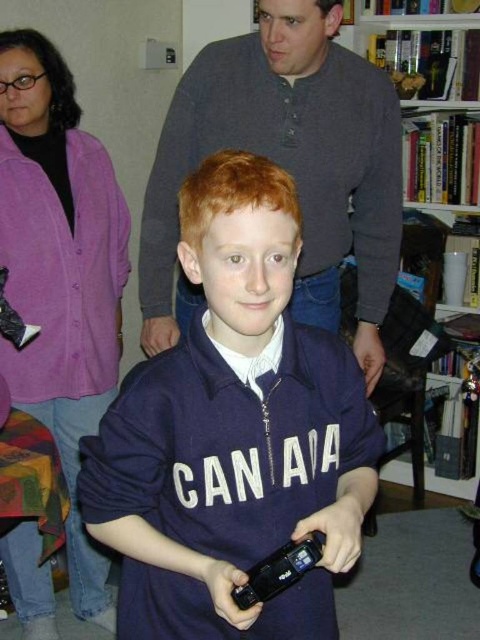
Does dark gray sweater at upper center have a smaller size compared to hardcover books at upper right?

No, dark gray sweater at upper center is not smaller than hardcover books at upper right.

Does dark gray sweater at upper center come in front of hardcover books at upper right?

Yes.

Locate an element on the screen. This screenshot has height=640, width=480. dark gray sweater at upper center is located at coordinates (287, 164).

This screenshot has height=640, width=480. Find the location of `dark gray sweater at upper center`. dark gray sweater at upper center is located at coordinates (287, 164).

Which is more to the left, navy blue zip-up sweater at center or dark gray sweater at upper center?

navy blue zip-up sweater at center is more to the left.

Can you confirm if navy blue zip-up sweater at center is wider than dark gray sweater at upper center?

No.

Is point (276, 634) closer to viewer compared to point (278, 45)?

That is True.

The width and height of the screenshot is (480, 640). Identify the location of navy blue zip-up sweater at center. (232, 433).

Who is shorter, navy blue zip-up sweater at center or hardcover books at upper right?

navy blue zip-up sweater at center is shorter.

Describe the element at coordinates (232, 433) in the screenshot. I see `navy blue zip-up sweater at center` at that location.

Locate an element on the screen. The height and width of the screenshot is (640, 480). navy blue zip-up sweater at center is located at coordinates (232, 433).